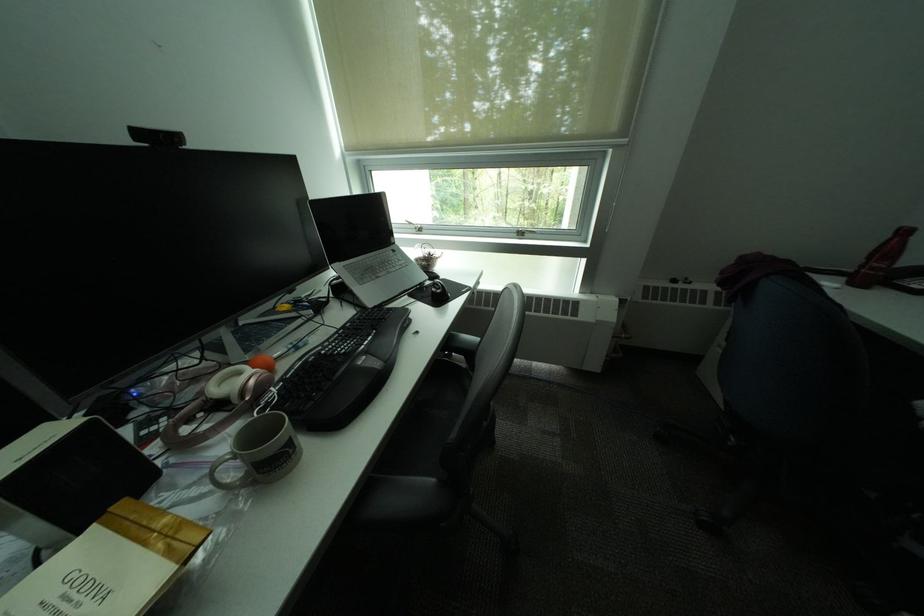
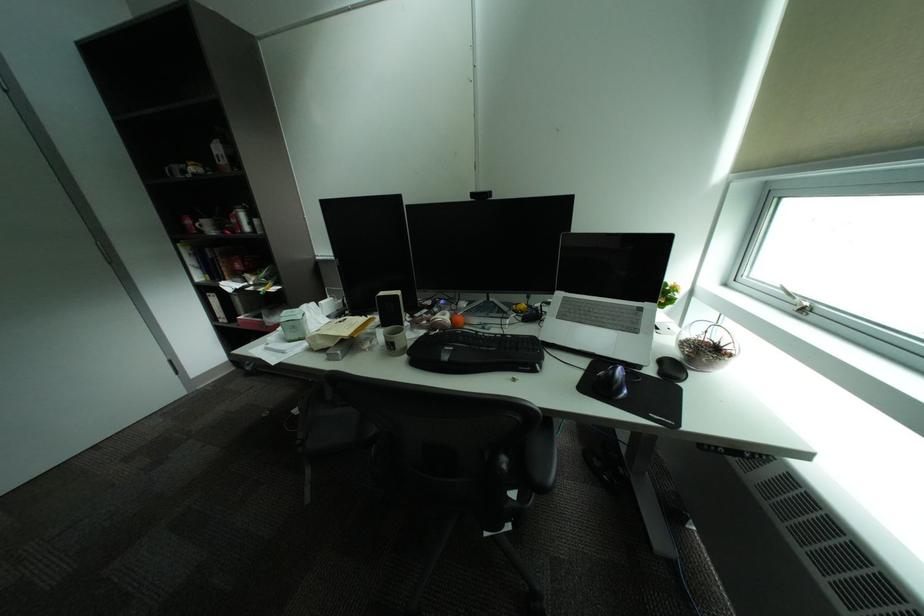
The point at [355,328] is marked in the first image. Where is the corresponding point in the second image?

(516, 336)